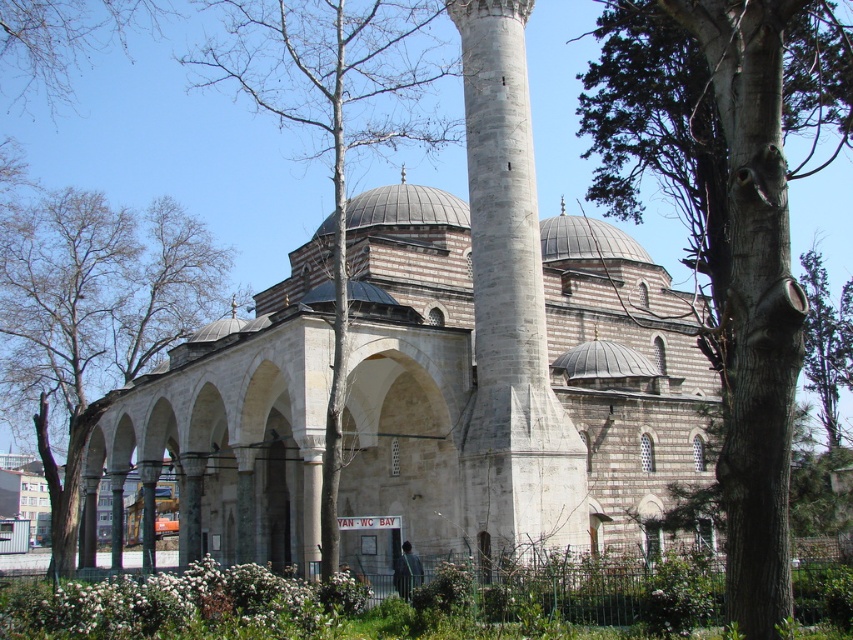
You are a visitor standing in front of the mosque and want to take a photo of the green leafy tree at left and the bare wood tree at center. Which tree should you focus on first if you want to capture both in the same frame?

The green leafy tree at left is positioned under the bare wood tree at center, so you should focus on the bare wood tree at center first to ensure both are in the frame.

Looking at this image, you are a gardener planning to trim the green leafy tree at left and the bare wood tree at center. Which tree requires more pruning to reduce its width?

The bare wood tree at center requires more pruning to reduce its width since it is thicker than the green leafy tree at left.